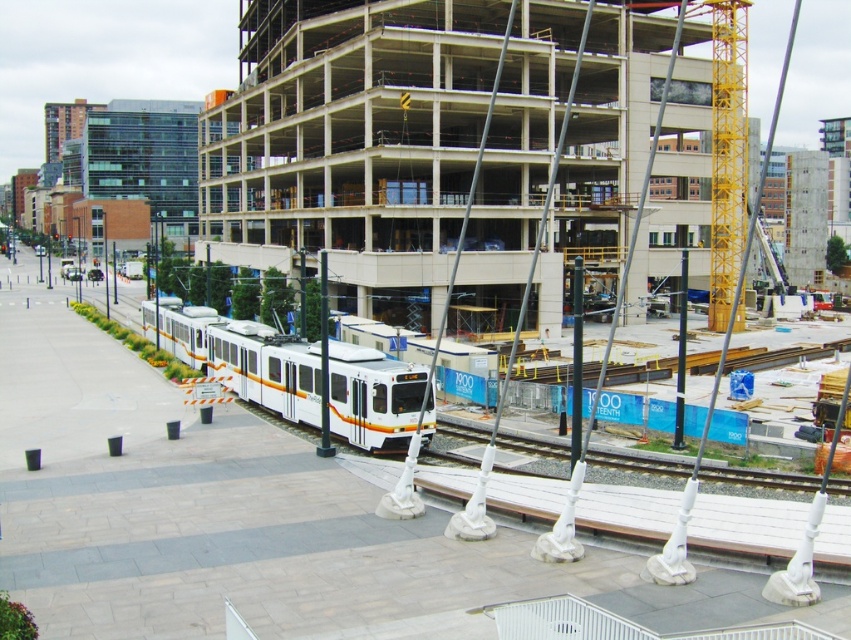
You are a city planner assessing the urban layout. Based on the scene, which object occupies more space in the image between the white concrete building at center and the gray metallic train track at center?

The white concrete building at center is bigger than the gray metallic train track at center, so it occupies more space in the image.

You are a construction worker standing at the point labeled point (660,460) and need to reach the point labeled point (220,468) to secure some equipment. Given the tram tracks running between these two points, is the path from your current position to the target point clear of the tram tracks?

The point labeled point (220,468) is in front of point (660,460), which means the path between them does not cross the tram tracks. Therefore, the path is clear of the tram tracks.

You are a pedestrian standing on the sidewalk and see the white glossy passenger train at center and the gray metallic train track at center. Which one is positioned to the left from your perspective?

The white glossy passenger train at center is positioned to the left of the gray metallic train track at center from your perspective.